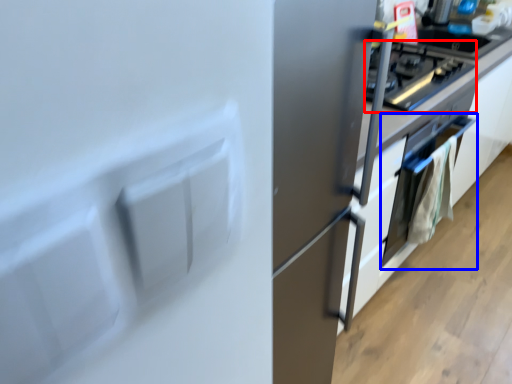
Question: Which of the following is the closest to the observer, home appliance (highlighted by a red box) or oven (highlighted by a blue box)?

Choices:
 (A) home appliance
 (B) oven

Answer: (A)